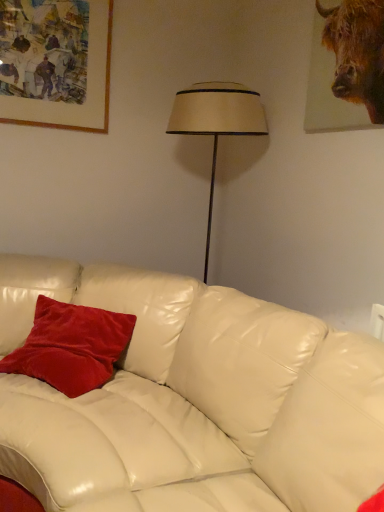
Question: From the image's perspective, is brown textured fur at upper right beneath velvet red pillow at center?

Choices:
 (A) no
 (B) yes

Answer: (A)

Question: Can you confirm if brown textured fur at upper right is shorter than velvet red pillow at center?

Choices:
 (A) yes
 (B) no

Answer: (B)

Question: Can you confirm if brown textured fur at upper right is smaller than velvet red pillow at center?

Choices:
 (A) yes
 (B) no

Answer: (A)

Question: From a real-world perspective, is brown textured fur at upper right physically below velvet red pillow at center?

Choices:
 (A) no
 (B) yes

Answer: (A)

Question: Are brown textured fur at upper right and velvet red pillow at center beside each other?

Choices:
 (A) no
 (B) yes

Answer: (A)

Question: Looking at the image, does brown textured fur at upper right seem bigger or smaller compared to velvet red pillow at center?

Choices:
 (A) small
 (B) big

Answer: (A)

Question: Considering the relative positions of brown textured fur at upper right and velvet red pillow at center in the image provided, is brown textured fur at upper right to the left or to the right of velvet red pillow at center?

Choices:
 (A) left
 (B) right

Answer: (B)

Question: In the image, is brown textured fur at upper right positioned in front of or behind velvet red pillow at center?

Choices:
 (A) front
 (B) behind

Answer: (A)

Question: Is point (375, 29) positioned closer to the camera than point (39, 333)?

Choices:
 (A) farther
 (B) closer

Answer: (B)

Question: Does point (349, 30) appear closer or farther from the camera than point (79, 91)?

Choices:
 (A) closer
 (B) farther

Answer: (A)

Question: From the image's perspective, relative to wooden picture frame at upper left, is brown textured fur at upper right above or below?

Choices:
 (A) above
 (B) below

Answer: (B)

Question: Is brown textured fur at upper right inside or outside of wooden picture frame at upper left?

Choices:
 (A) outside
 (B) inside

Answer: (A)

Question: From a real-world perspective, is brown textured fur at upper right positioned above or below wooden picture frame at upper left?

Choices:
 (A) below
 (B) above

Answer: (A)

Question: From a real-world perspective, is velvet red pillow at center above or below brown textured fur at upper right?

Choices:
 (A) above
 (B) below

Answer: (B)

Question: From the image's perspective, relative to brown textured fur at upper right, is velvet red pillow at center above or below?

Choices:
 (A) below
 (B) above

Answer: (A)